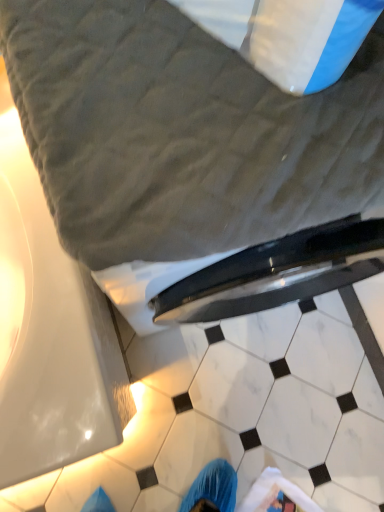
Question: From a real-world perspective, is white marble tile at center, which ranks as the 2th tile in back-to-front order, physically above gray quilted bed at upper center?

Choices:
 (A) no
 (B) yes

Answer: (A)

Question: Is white marble tile at center, acting as the first tile starting from the front, not inside gray quilted bed at upper center?

Choices:
 (A) no
 (B) yes

Answer: (B)

Question: Can you confirm if white marble tile at center, which ranks as the 2th tile in back-to-front order, is taller than gray quilted bed at upper center?

Choices:
 (A) no
 (B) yes

Answer: (A)

Question: Does white marble tile at center, which ranks as the 2th tile in back-to-front order, turn towards gray quilted bed at upper center?

Choices:
 (A) yes
 (B) no

Answer: (B)

Question: Is white marble tile at center, acting as the first tile starting from the front, in front of gray quilted bed at upper center?

Choices:
 (A) no
 (B) yes

Answer: (A)

Question: Choose the correct answer: Is white marble tile at center, which ranks as the 2th tile in back-to-front order, inside gray quilted bed at upper center or outside it?

Choices:
 (A) outside
 (B) inside

Answer: (A)

Question: From their relative heights in the image, would you say white marble tile at center, acting as the first tile starting from the front, is taller or shorter than gray quilted bed at upper center?

Choices:
 (A) short
 (B) tall

Answer: (A)

Question: Considering the relative positions of white marble tile at center, acting as the first tile starting from the front, and gray quilted bed at upper center in the image provided, is white marble tile at center, acting as the first tile starting from the front, to the left or to the right of gray quilted bed at upper center?

Choices:
 (A) left
 (B) right

Answer: (A)

Question: In the image, is white marble tile at center, which ranks as the 2th tile in back-to-front order, positioned in front of or behind gray quilted bed at upper center?

Choices:
 (A) behind
 (B) front

Answer: (A)

Question: Is white marble tile at lower center, acting as the 1th tile starting from the back, taller or shorter than white marble tile at center, acting as the first tile starting from the front?

Choices:
 (A) tall
 (B) short

Answer: (B)

Question: Is white marble tile at lower center, acting as the 1th tile starting from the back, inside the boundaries of white marble tile at center, acting as the first tile starting from the front, or outside?

Choices:
 (A) inside
 (B) outside

Answer: (A)

Question: From the image's perspective, is white marble tile at lower center, acting as the 1th tile starting from the back, positioned above or below white marble tile at center, acting as the first tile starting from the front?

Choices:
 (A) below
 (B) above

Answer: (A)

Question: From a real-world perspective, is white marble tile at lower center, which appears as the 2th tile when viewed from the front, positioned above or below white marble tile at center, which ranks as the 2th tile in back-to-front order?

Choices:
 (A) below
 (B) above

Answer: (B)

Question: Relative to white marble tile at lower center, which appears as the 2th tile when viewed from the front, is gray quilted bed at upper center in front or behind?

Choices:
 (A) front
 (B) behind

Answer: (A)

Question: Considering the positions of gray quilted bed at upper center and white marble tile at lower center, acting as the 1th tile starting from the back, in the image, is gray quilted bed at upper center bigger or smaller than white marble tile at lower center, acting as the 1th tile starting from the back,?

Choices:
 (A) small
 (B) big

Answer: (B)